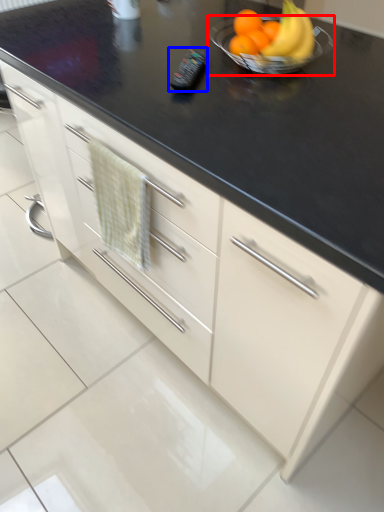
Question: Which object appears closest to the camera in this image, glass bowl (highlighted by a red box) or appliance (highlighted by a blue box)?

Choices:
 (A) glass bowl
 (B) appliance

Answer: (A)